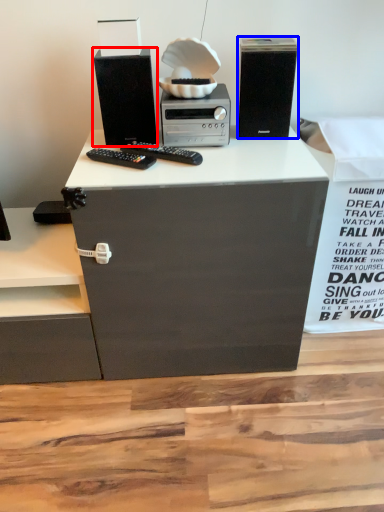
Question: Which object appears closest to the camera in this image, computer tower (highlighted by a red box) or computer tower (highlighted by a blue box)?

Choices:
 (A) computer tower
 (B) computer tower

Answer: (A)